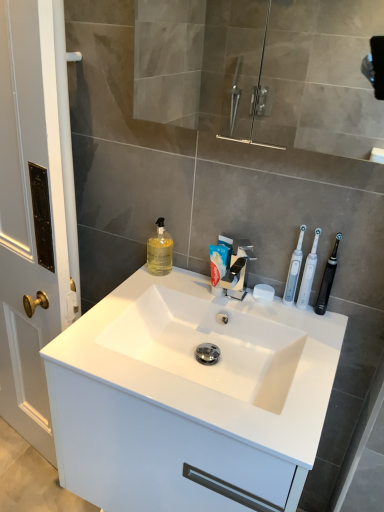
Find the location of a particular element. The height and width of the screenshot is (512, 384). vacant space to the left of black plastic toothbrush at right, which is the third toothbrush from left to right is located at coordinates (267, 309).